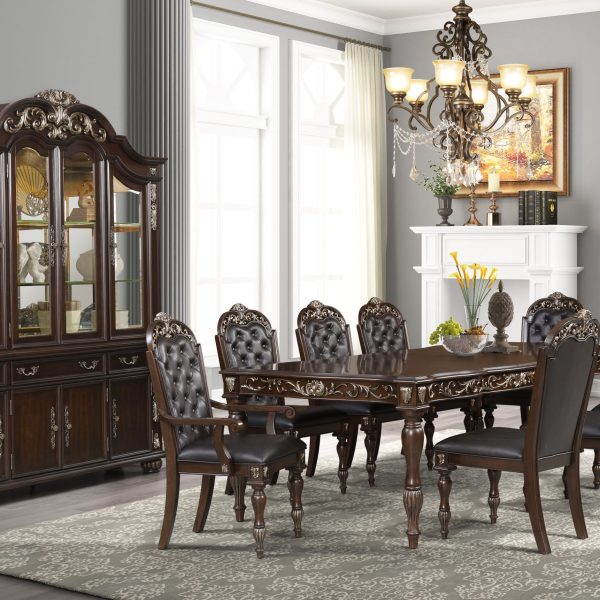
At what (x,y) coordinates should I click in order to perform the action: click on chairs. Please return your answer as a coordinate pair (x, y). This screenshot has width=600, height=600. Looking at the image, I should click on (561, 310), (570, 375), (177, 352), (254, 333), (342, 334), (388, 330).